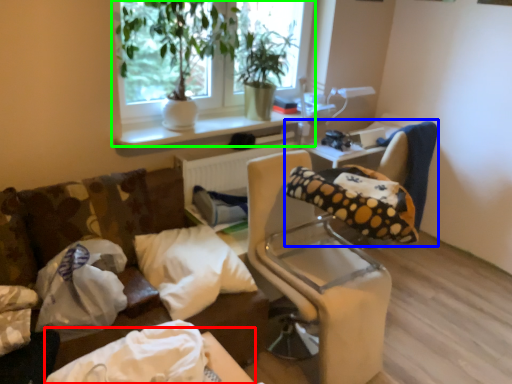
Question: Based on their relative distances, which object is farther from table (highlighted by a red box)? Choose from bean bag chair (highlighted by a blue box) and window (highlighted by a green box).

Choices:
 (A) bean bag chair
 (B) window

Answer: (B)